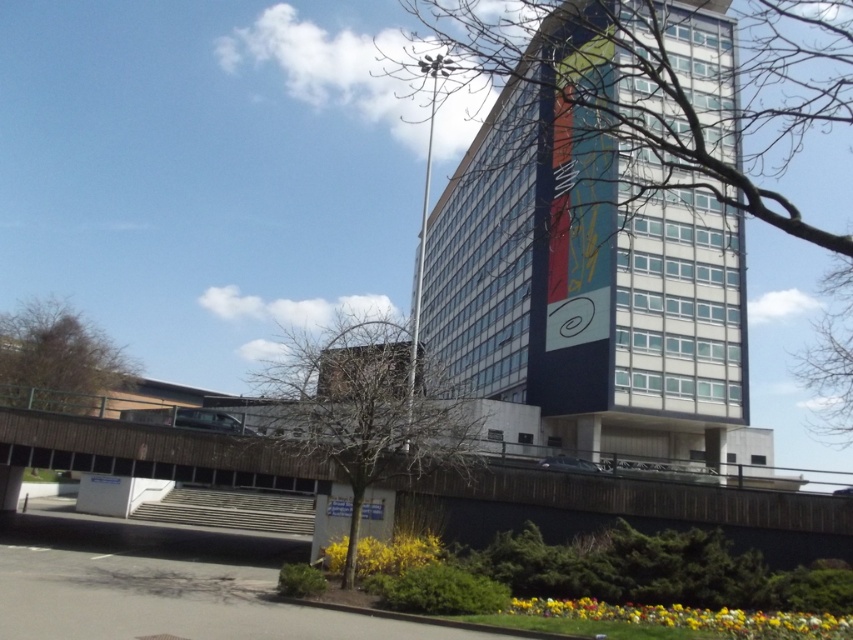
Question: Does bare branches at upper right have a lesser width compared to brown textured tree at lower left?

Choices:
 (A) yes
 (B) no

Answer: (B)

Question: Which point is farther to the camera?

Choices:
 (A) (1, 356)
 (B) (454, 452)
 (C) (611, 19)

Answer: (A)

Question: From the image, what is the correct spatial relationship of bare branches at center in relation to brown textured tree at lower left?

Choices:
 (A) above
 (B) below

Answer: (B)

Question: Which point is farther from the camera taking this photo?

Choices:
 (A) (355, 540)
 (B) (115, 346)
 (C) (534, 77)

Answer: (B)

Question: Which of the following is the farthest from the observer?

Choices:
 (A) bare branches at upper right
 (B) brown textured tree at lower left
 (C) bare branches at center

Answer: (B)

Question: Is bare branches at upper right below bare branches at center?

Choices:
 (A) yes
 (B) no

Answer: (B)